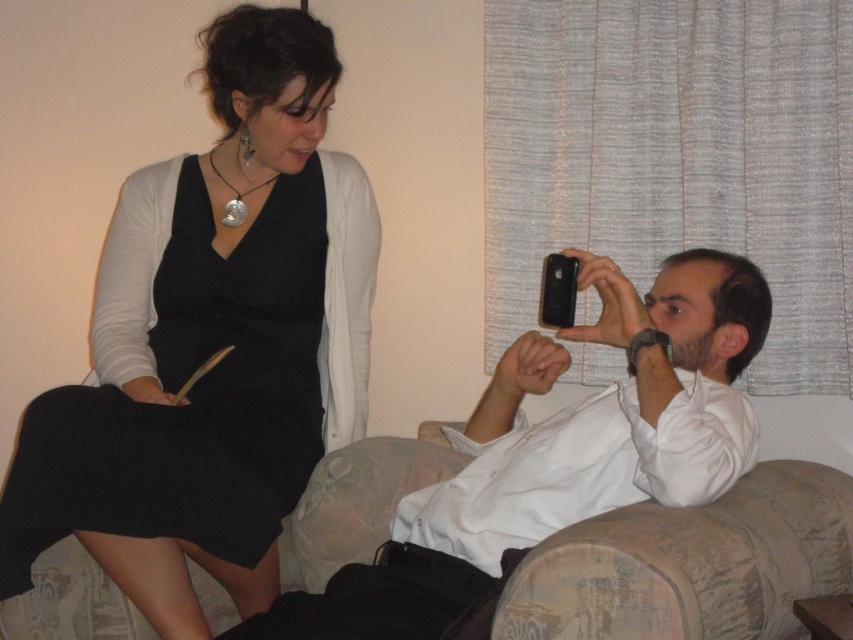
Between white matte shirt at center and silver metallic pendant at upper center, which one is positioned lower?

Positioned lower is white matte shirt at center.

Is point (364, 588) positioned in front of point (235, 220)?

That is True.

Identify the location of white matte shirt at center. (561, 451).

Is white matte shirt at center shorter than black matte dress at left?

Yes, white matte shirt at center is shorter than black matte dress at left.

Is point (554, 481) behind point (196, 528)?

That is True.

The image size is (853, 640). Identify the location of white matte shirt at center. coord(561,451).

From the picture: Does black matte dress at left appear on the right side of silver metallic pendant at upper center?

Incorrect, black matte dress at left is not on the right side of silver metallic pendant at upper center.

Between black matte dress at left and silver metallic pendant at upper center, which one appears on the right side from the viewer's perspective?

silver metallic pendant at upper center

Between point (64, 508) and point (271, 179), which one is positioned in front?

Point (64, 508)

Where is `black matte dress at left`? black matte dress at left is located at coordinates (190, 397).